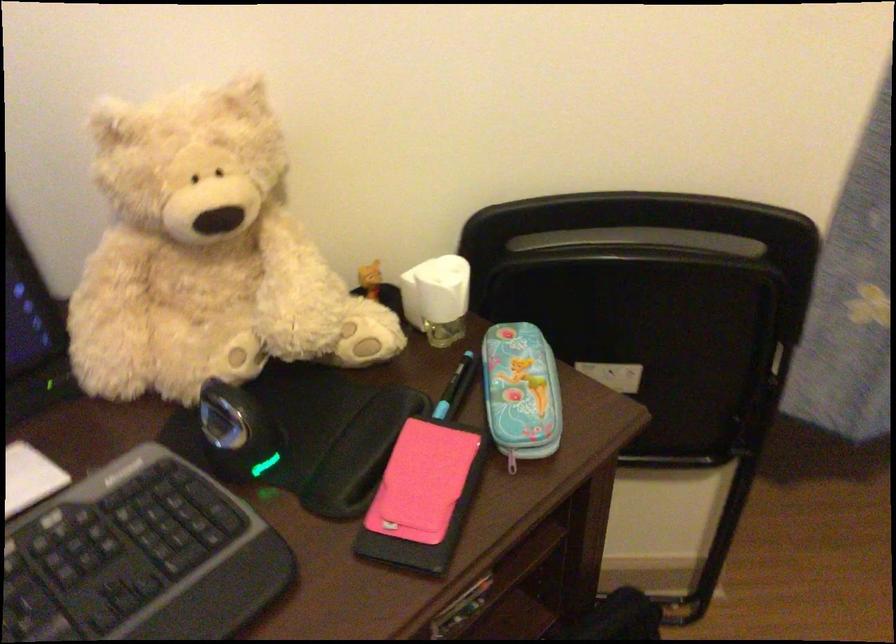
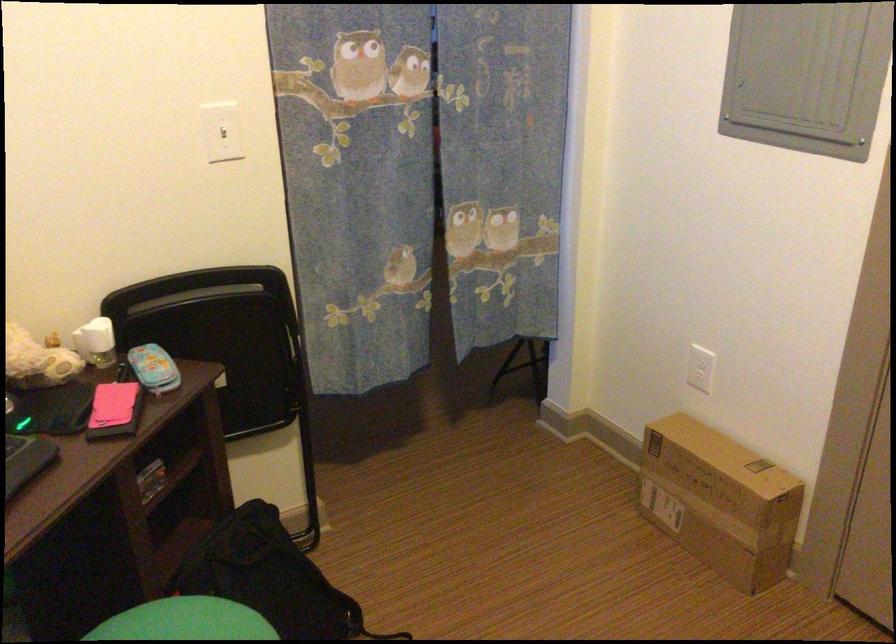
The point at (427, 498) is marked in the first image. Where is the corresponding point in the second image?

(114, 410)